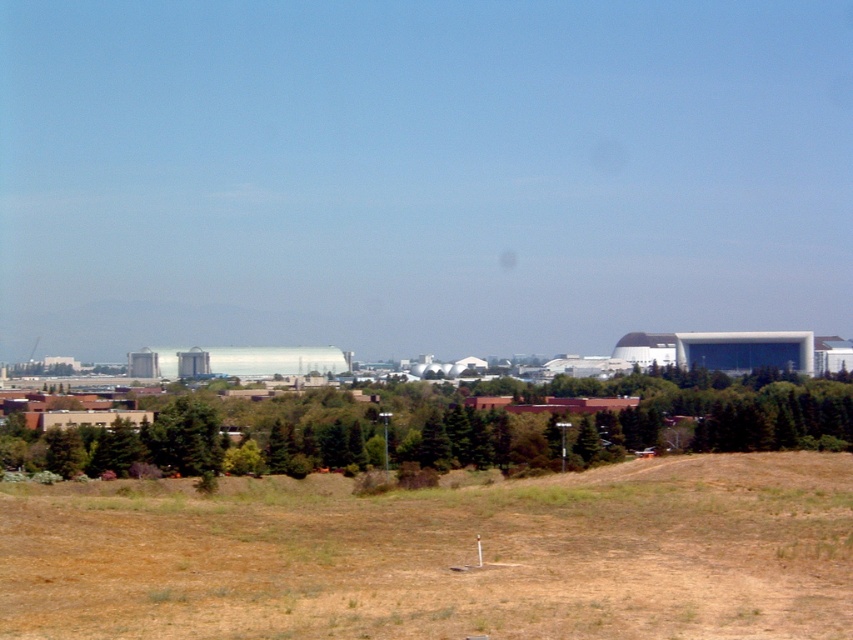
Does brown grass at lower center appear over green leafy tree at lower center?

Yes.

Which is behind, point (718, 577) or point (556, 396)?

Positioned behind is point (556, 396).

Image resolution: width=853 pixels, height=640 pixels. Find the location of `brown grass at lower center`. brown grass at lower center is located at coordinates (440, 554).